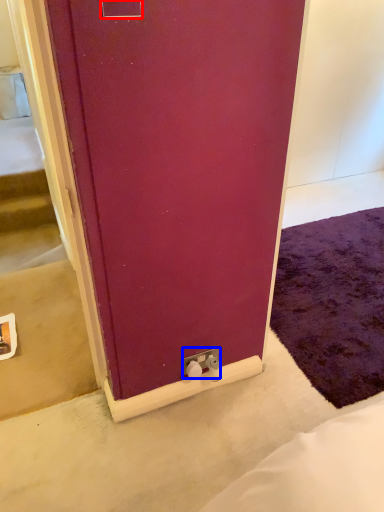
Question: Which object is closer to the camera taking this photo, electric outlet (highlighted by a red box) or electric outlet (highlighted by a blue box)?

Choices:
 (A) electric outlet
 (B) electric outlet

Answer: (A)